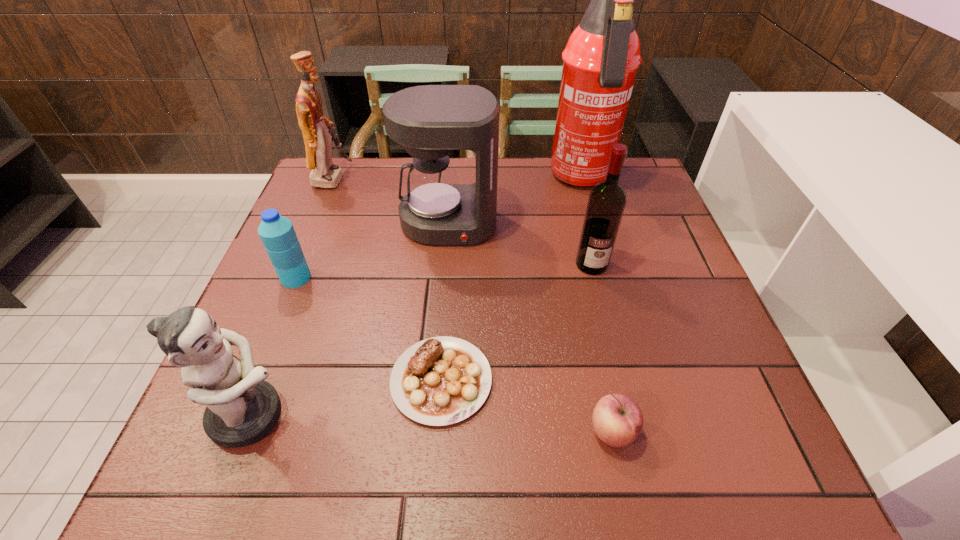
The width and height of the screenshot is (960, 540). What are the coordinates of `the tallest object` in the screenshot? It's located at (600, 61).

This screenshot has width=960, height=540. I want to click on nutcracker, so click(x=318, y=144).

The image size is (960, 540). Identify the location of coffee maker. (430, 121).

At what (x,y) coordinates should I click in order to perform the action: click on alcohol. Please return your answer as a coordinate pair (x, y). Looking at the image, I should click on (607, 200).

At what (x,y) coordinates should I click in order to perform the action: click on figurine. Please return your answer as a coordinate pair (x, y). The image size is (960, 540). Looking at the image, I should click on (241, 409).

Where is `the sixth tallest object`? The image size is (960, 540). the sixth tallest object is located at coordinates [x=277, y=233].

Where is `the second shortest object`? This screenshot has width=960, height=540. the second shortest object is located at coordinates (617, 420).

Locate an element on the screen. The width and height of the screenshot is (960, 540). steak is located at coordinates (439, 381).

Locate an element on the screen. This screenshot has width=960, height=540. free space located on the trigger side of the tallest object is located at coordinates (614, 296).

This screenshot has width=960, height=540. What are the coordinates of `blank area located on the front-facing side of the nutcracker` in the screenshot? It's located at (382, 178).